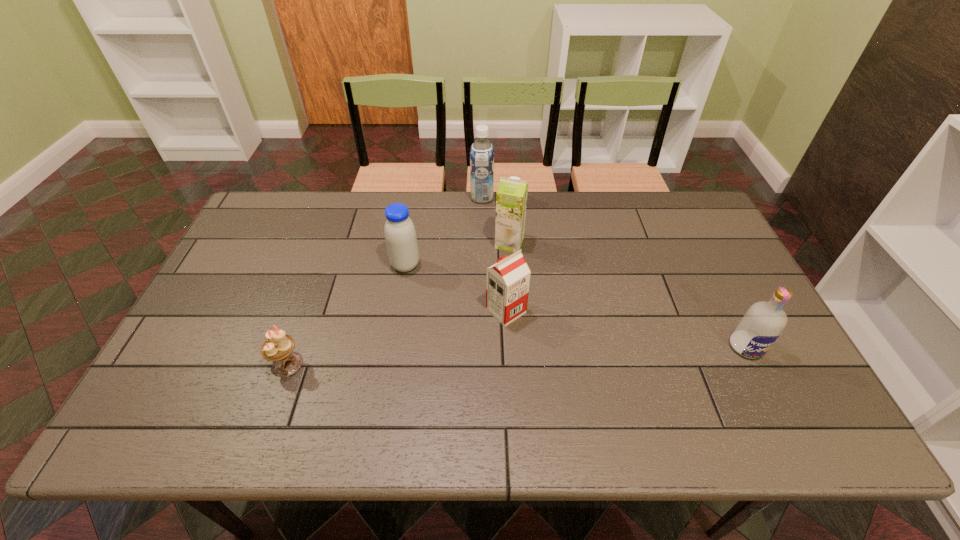
The width and height of the screenshot is (960, 540). I want to click on vacant space located on the label of the farthest object, so click(x=431, y=198).

I want to click on blank space located 0.130m on the back of the second farthest soya milk, so click(x=507, y=209).

Locate an element on the screen. vacant space situated 0.230m on the left of the second nearest soya milk is located at coordinates (314, 265).

Locate an element on the screen. The width and height of the screenshot is (960, 540). free spot located 0.330m on the right of the fourth farthest object is located at coordinates (648, 311).

I want to click on blank area located on the label of the vodka, so click(x=766, y=387).

Image resolution: width=960 pixels, height=540 pixels. Identify the location of free space located on the right of the leftmost object. (344, 364).

Where is `object present at the right edge`? Image resolution: width=960 pixels, height=540 pixels. object present at the right edge is located at coordinates (760, 327).

This screenshot has width=960, height=540. Find the location of `free space at the far edge`. free space at the far edge is located at coordinates (636, 193).

Where is `vacant space at the near edge of the desktop`? This screenshot has height=540, width=960. vacant space at the near edge of the desktop is located at coordinates (529, 440).

In the image, there is a desktop. In order to click on vacant space at the left edge in this screenshot , I will do `click(221, 369)`.